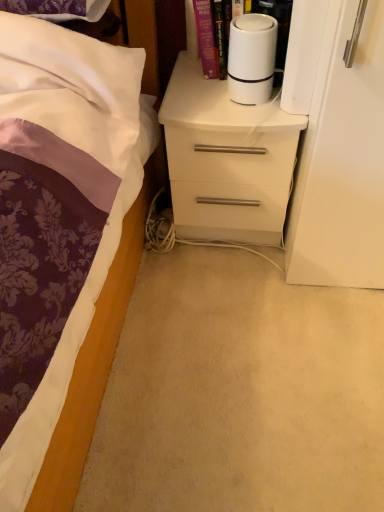
Question: Does point (193, 10) appear closer or farther from the camera than point (249, 88)?

Choices:
 (A) closer
 (B) farther

Answer: (B)

Question: Is white matte cylindrical device at upper right bigger or smaller than white matte cylindrical object at upper center?

Choices:
 (A) big
 (B) small

Answer: (A)

Question: Estimate the real-world distances between objects in this image. Which object is closer to the white matte cylindrical object at upper center?

Choices:
 (A) white glossy chest of drawers at center
 (B) white matte cylindrical device at upper right

Answer: (B)

Question: Which is nearer to the white matte cylindrical object at upper center?

Choices:
 (A) white matte cylindrical device at upper right
 (B) white glossy chest of drawers at center

Answer: (A)